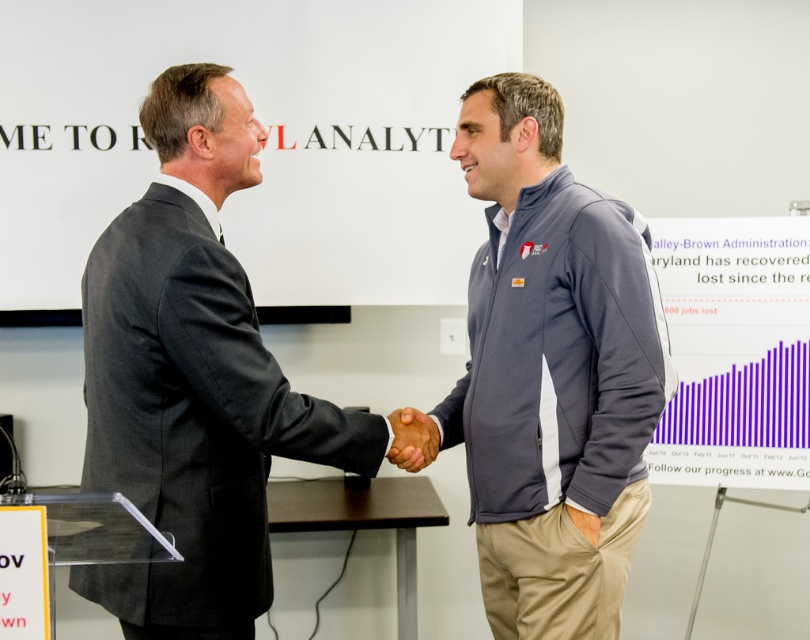
Does dark gray suit at center appear under brown leather hand at center?

Incorrect, dark gray suit at center is not positioned below brown leather hand at center.

Where is `dark gray suit at center`? The width and height of the screenshot is (810, 640). dark gray suit at center is located at coordinates (194, 378).

Which is above, gray fleece jacket at center or brown leather hand at center?

gray fleece jacket at center is above.

Is gray fleece jacket at center below brown leather hand at center?

No.

What do you see at coordinates (552, 372) in the screenshot?
I see `gray fleece jacket at center` at bounding box center [552, 372].

Identify the location of gray fleece jacket at center. (552, 372).

Which of these two, gray fleece jacket at center or dark gray suit at center, stands taller?

gray fleece jacket at center is taller.

Does gray fleece jacket at center have a lesser width compared to dark gray suit at center?

Yes, gray fleece jacket at center is thinner than dark gray suit at center.

Is point (582, 188) positioned in front of point (124, 292)?

That is False.

You are a GUI agent. You are given a task and a screenshot of the screen. Output one action in this format:
    pyautogui.click(x=<x>, y=<y>)
    Task: Click on the gray fleece jacket at center
    The image size is (810, 640).
    Given the screenshot: What is the action you would take?
    pyautogui.click(x=552, y=372)